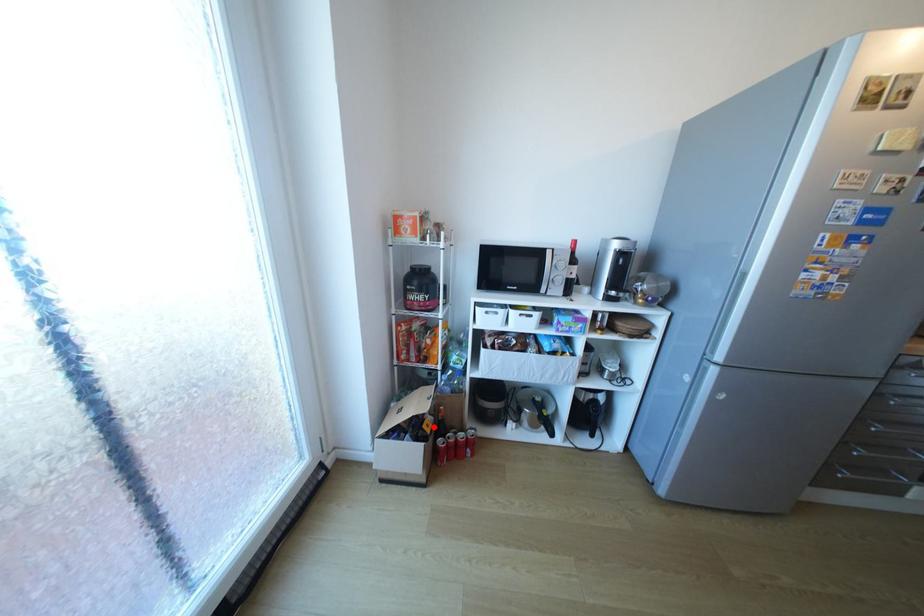
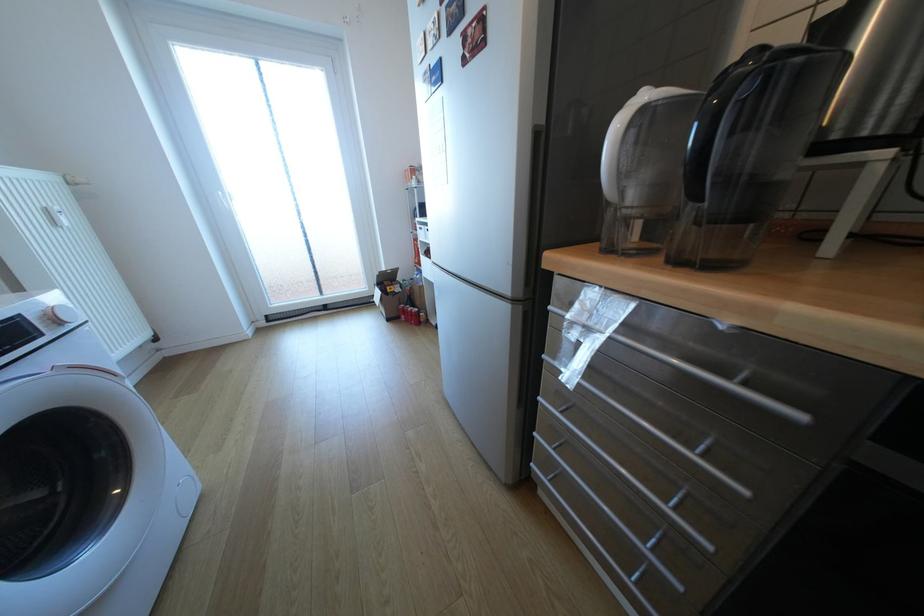
In the second image, find the point that corresponds to the highlighted location in the first image.

(397, 288)